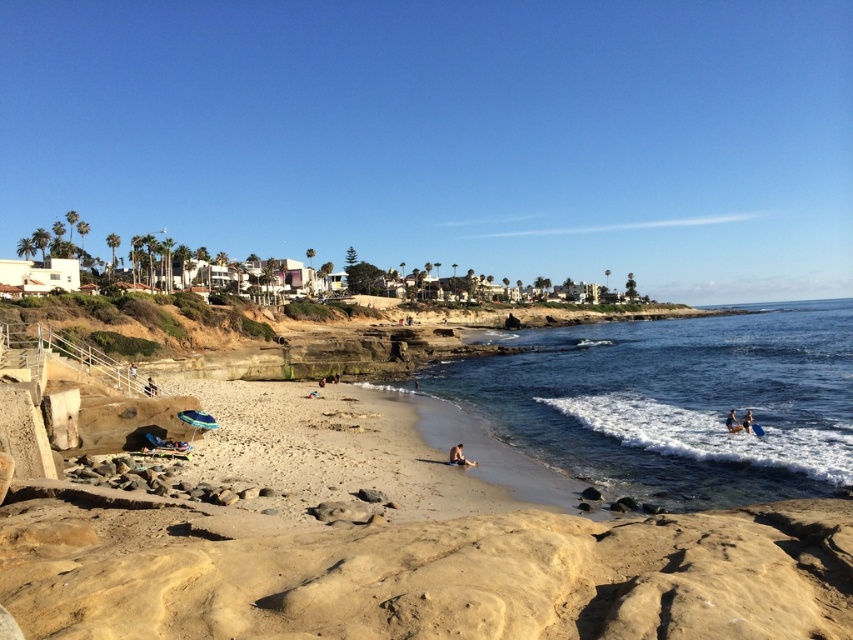
You are standing at the point marked as point [459,456]. What is the color of the ground beneath your feet?

The ground beneath your feet at point [459,456] is light brown sand at lower center.

You are a beachgoer who wants to store your belongings. You have a blue fabric surfboard at lower right and a tan fabric towel at lower left. Which item takes up more space when placed on the sand?

The tan fabric towel at lower left takes up more space than the blue fabric surfboard at lower right because the surfboard is smaller in size.